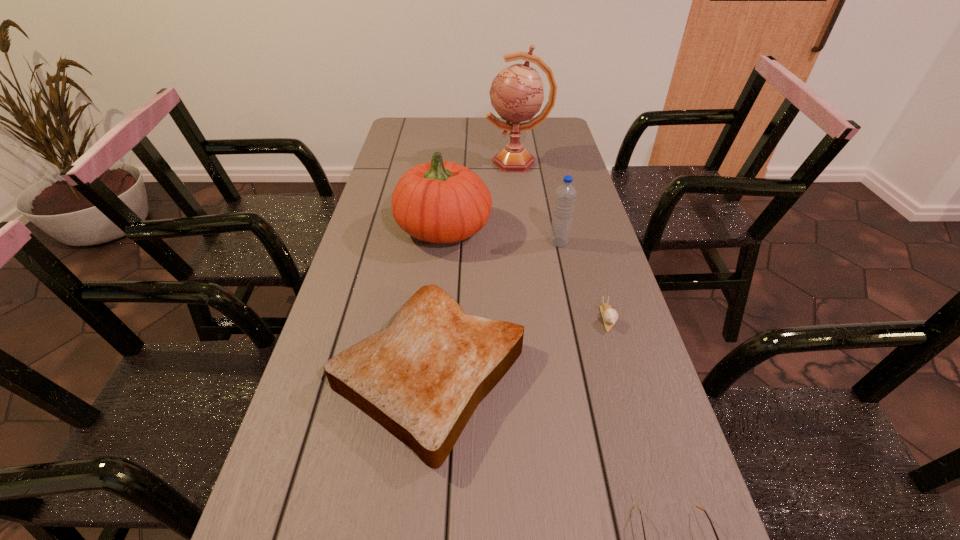
Locate an element on the screen. The height and width of the screenshot is (540, 960). blank space located 0.210m on the back of the water bottle is located at coordinates [549, 198].

This screenshot has width=960, height=540. What are the coordinates of `free location located 0.260m on the back of the bread` in the screenshot? It's located at (444, 240).

Identify the location of vacant space positioned on the shell of the escargot. This screenshot has height=540, width=960. (634, 408).

At what (x,y) coordinates should I click in order to perform the action: click on pumpkin positioned at the left edge. Please return your answer as a coordinate pair (x, y). Looking at the image, I should click on (439, 202).

I want to click on bread that is at the left edge, so click(421, 378).

This screenshot has width=960, height=540. I want to click on globe that is at the right edge, so click(516, 93).

At what (x,y) coordinates should I click in order to perform the action: click on water bottle that is at the right edge. Please return your answer as a coordinate pair (x, y). Image resolution: width=960 pixels, height=540 pixels. Looking at the image, I should click on (565, 195).

Locate an element on the screen. escargot present at the right edge is located at coordinates (610, 316).

Where is `vacant area at the far edge of the desktop`? vacant area at the far edge of the desktop is located at coordinates pos(444,134).

What are the coordinates of `free space at the left edge` in the screenshot? It's located at (304, 460).